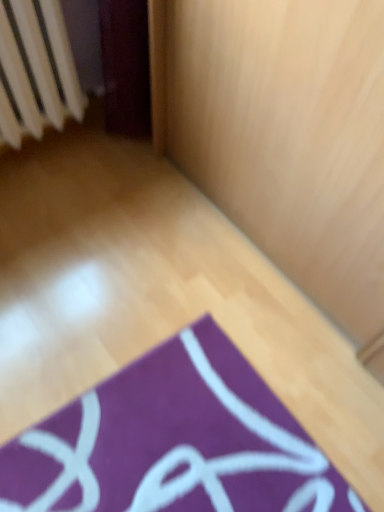
Locate an element on the screen. The height and width of the screenshot is (512, 384). free location above purple fabric yoga mat at lower center (from a real-world perspective) is located at coordinates (170, 451).